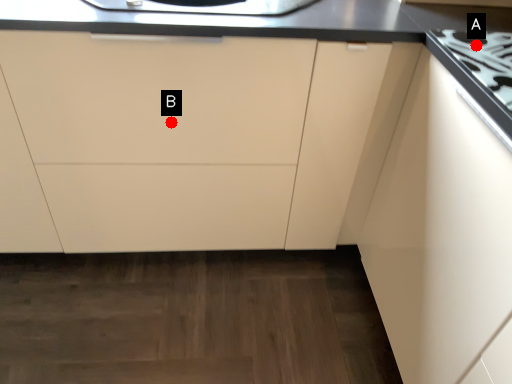
Question: Two points are circled on the image, labeled by A and B beside each circle. Which point appears closest to the camera in this image?

Choices:
 (A) A is closer
 (B) B is closer

Answer: (A)